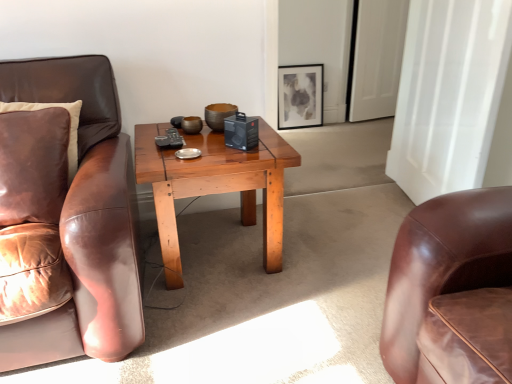
Question: From a real-world perspective, is leather pillow at left physically above wooden coffee table at center?

Choices:
 (A) no
 (B) yes

Answer: (B)

Question: Can you confirm if leather pillow at left is shorter than wooden coffee table at center?

Choices:
 (A) no
 (B) yes

Answer: (B)

Question: From a real-world perspective, is leather pillow at left located beneath wooden coffee table at center?

Choices:
 (A) no
 (B) yes

Answer: (A)

Question: Is leather pillow at left at the left side of wooden coffee table at center?

Choices:
 (A) no
 (B) yes

Answer: (B)

Question: Is leather pillow at left bigger than wooden coffee table at center?

Choices:
 (A) yes
 (B) no

Answer: (B)

Question: Does leather pillow at left lie in front of wooden coffee table at center?

Choices:
 (A) no
 (B) yes

Answer: (B)

Question: Considering the relative sizes of matte black picture frame at upper center and white glossy door at upper right in the image provided, is matte black picture frame at upper center thinner than white glossy door at upper right?

Choices:
 (A) no
 (B) yes

Answer: (B)

Question: Is there a large distance between matte black picture frame at upper center and white glossy door at upper right?

Choices:
 (A) no
 (B) yes

Answer: (A)

Question: Is matte black picture frame at upper center positioned with its back to white glossy door at upper right?

Choices:
 (A) yes
 (B) no

Answer: (B)

Question: Is white glossy door at upper right completely or partially inside matte black picture frame at upper center?

Choices:
 (A) yes
 (B) no

Answer: (B)

Question: Does matte black picture frame at upper center lie in front of white glossy door at upper right?

Choices:
 (A) yes
 (B) no

Answer: (B)

Question: From the image's perspective, is matte black picture frame at upper center beneath white glossy door at upper right?

Choices:
 (A) yes
 (B) no

Answer: (A)

Question: Considering the relative positions of leather pillow at left and white glossy door at upper right in the image provided, is leather pillow at left to the right of white glossy door at upper right from the viewer's perspective?

Choices:
 (A) no
 (B) yes

Answer: (A)